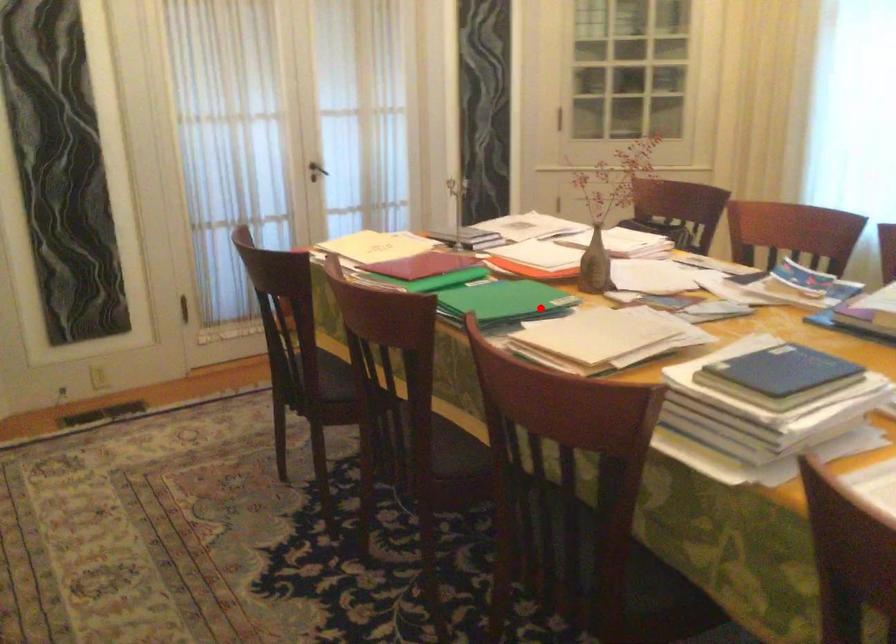
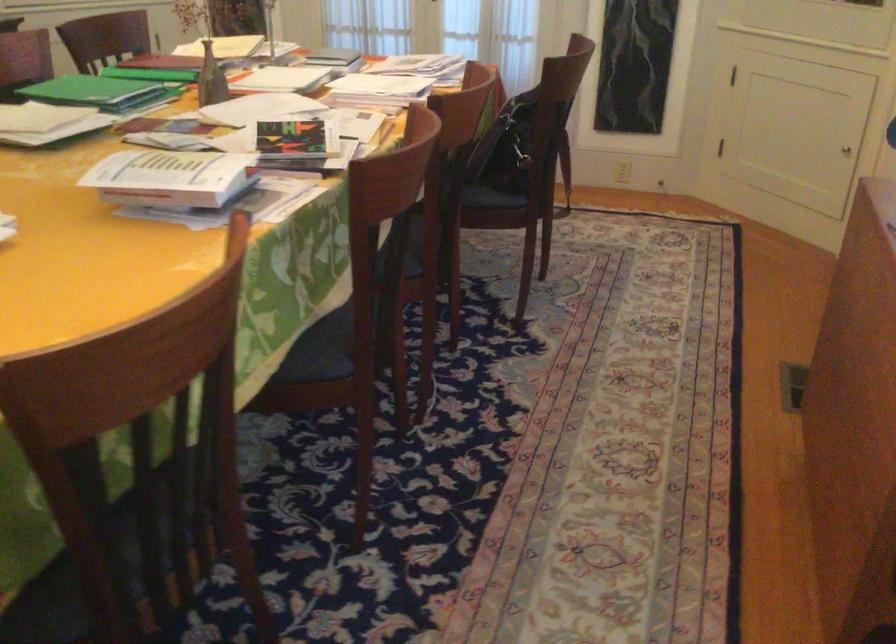
Question: I am providing you with two images of the same scene from different viewpoints. A red point is shown in image1. For the corresponding object point in image2, is it positioned nearer or farther from the camera?

Choices:
 (A) Nearer
 (B) Farther

Answer: (B)